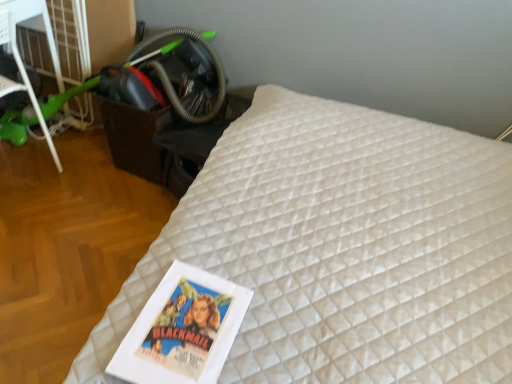
Question: From their relative heights in the image, would you say black plastic table at lower left is taller or shorter than white quilted mattress at center?

Choices:
 (A) short
 (B) tall

Answer: (A)

Question: From a real-world perspective, is black plastic table at lower left above or below white quilted mattress at center?

Choices:
 (A) below
 (B) above

Answer: (A)

Question: Which is farther from the green plastic scooter at left?

Choices:
 (A) white quilted mattress at center
 (B) black plastic table at lower left

Answer: (A)

Question: Based on their relative distances, which object is farther from the white quilted mattress at center?

Choices:
 (A) black plastic table at lower left
 (B) green plastic scooter at left

Answer: (B)